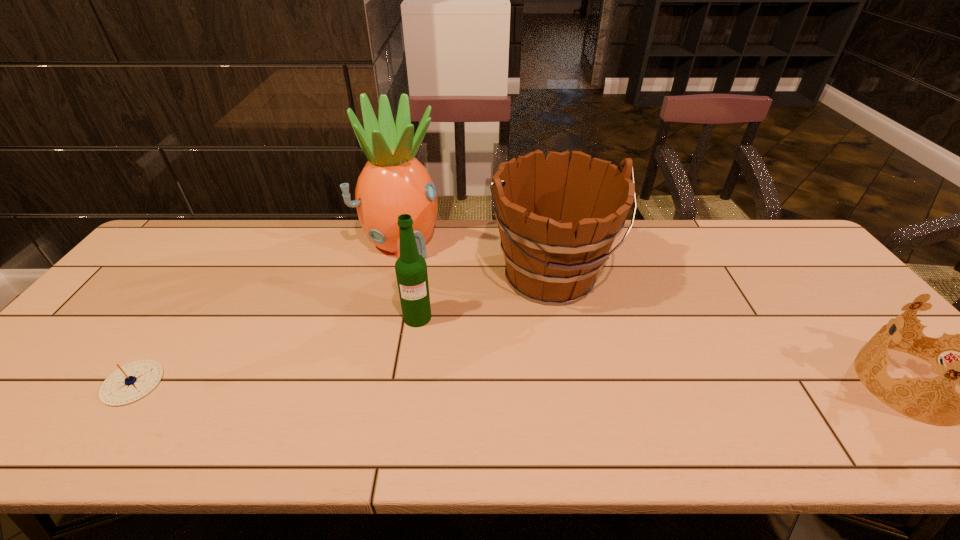
Find the location of a particular element. vacant space on the desktop that is between the shortest object and the second shortest object and is positioned at the entrance of the tallest object is located at coordinates (515, 383).

Find the location of a particular element. The image size is (960, 540). free space on the desktop that is between the leftmost object and the rightmost object and is positioned with the handle on the wine bucket is located at coordinates (613, 384).

Identify the location of vacant space on the desktop that is between the shortest object and the rightmost object and is positioned on the label of the beer bottle. This screenshot has height=540, width=960. click(428, 383).